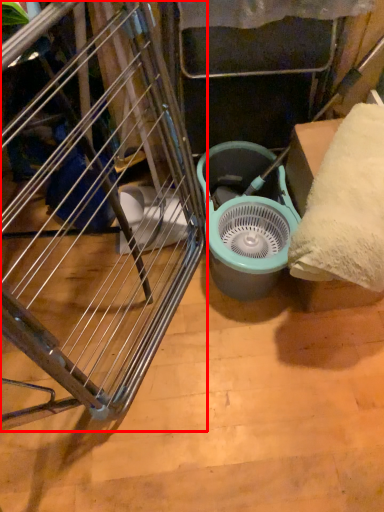
Question: From the image's perspective, what is the correct spatial positioning of furniture (annotated by the red box) in reference to mechanical fan?

Choices:
 (A) above
 (B) below

Answer: (B)